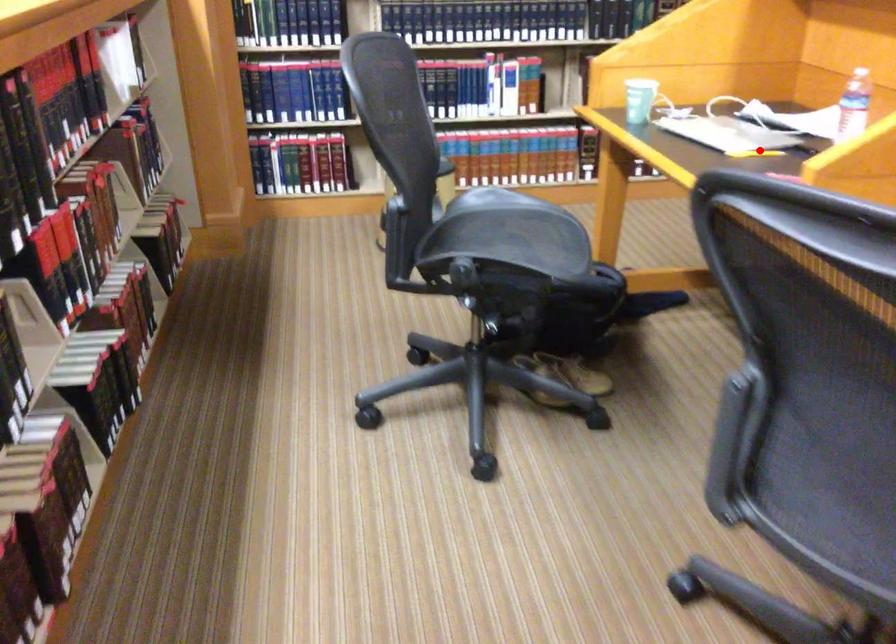
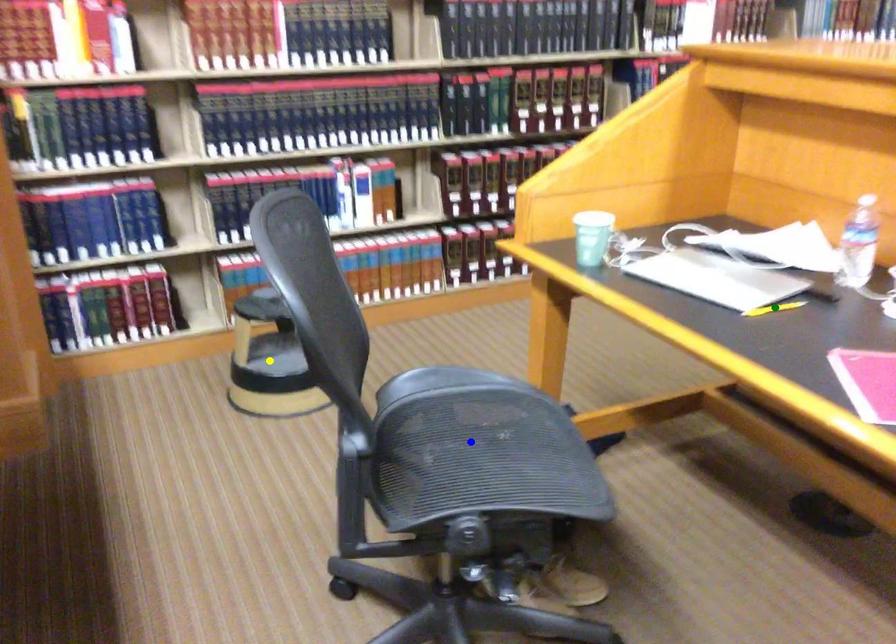
Question: I am providing you with two images of the same scene from different viewpoints. A red point is marked on the first image. You are given multiple points on the second image. Which spot in image 2 lines up with the point in image 1?

Choices:
 (A) green point
 (B) yellow point
 (C) blue point

Answer: (A)